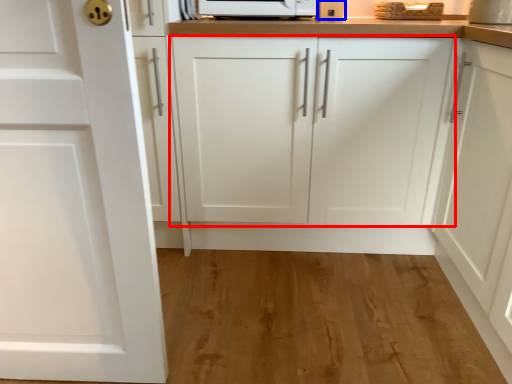
Question: Among these objects, which one is nearest to the camera, cabinetry (highlighted by a red box) or appliance (highlighted by a blue box)?

Choices:
 (A) cabinetry
 (B) appliance

Answer: (A)